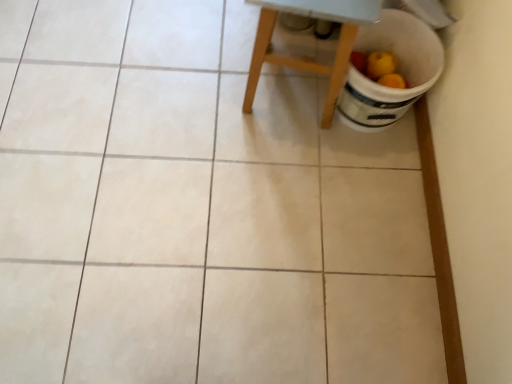
Locate an element on the screen. This screenshot has height=384, width=512. free location in front of wooden stool at lower right is located at coordinates (284, 170).